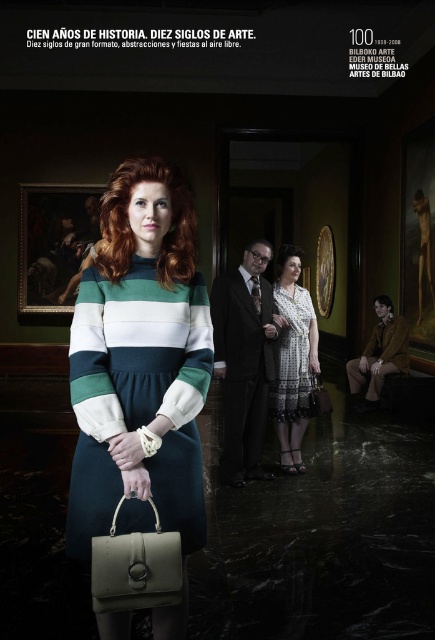
I want to click on dark gray suit at center, so click(x=244, y=360).

Does dark gray suit at center come in front of white lace dress at center?

Yes, dark gray suit at center is in front of white lace dress at center.

What do you see at coordinates (244, 360) in the screenshot? I see `dark gray suit at center` at bounding box center [244, 360].

Where is `dark gray suit at center`? The image size is (435, 640). dark gray suit at center is located at coordinates (244, 360).

Does point (241, 296) come closer to viewer compared to point (160, 531)?

No, (241, 296) is behind (160, 531).

Who is more distant from viewer, [250,406] or [127,576]?

The point [250,406] is behind.

I want to click on dark gray suit at center, so click(244, 360).

Does green wool dress at center have a lesser width compared to dark gray suit at center?

Yes, green wool dress at center is thinner than dark gray suit at center.

Which is behind, point (146, 502) or point (224, 353)?

The point (224, 353) is behind.

Which is behind, point (90, 500) or point (241, 426)?

Point (241, 426)

This screenshot has height=640, width=435. I want to click on green wool dress at center, so click(x=137, y=397).